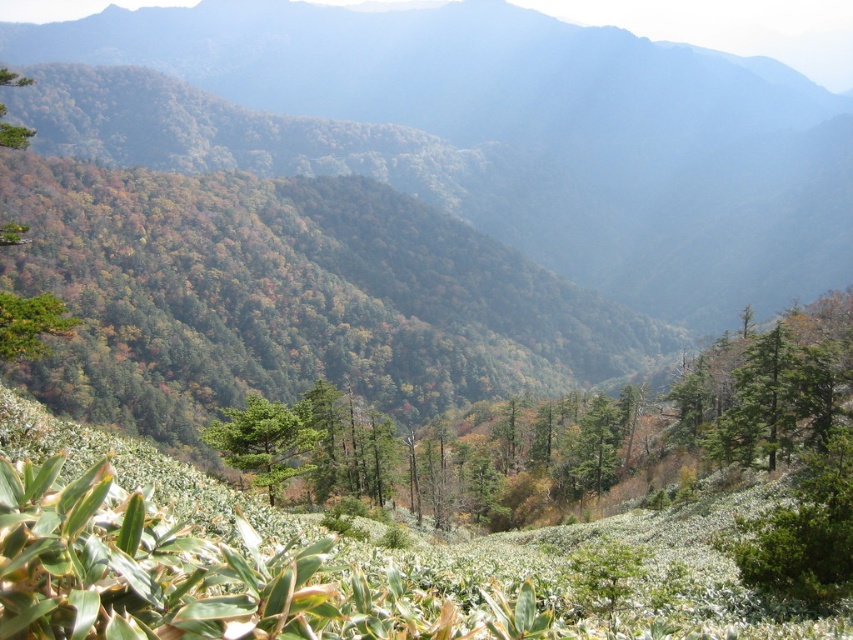
You are standing at the viewpoint and want to take a photo of the landscape. The camera you are using has a maximum focus range of 150 feet. Will the point at coordinates point [281,445] be in focus?

The distance of point [281,445] from the camera is 168.14 feet, which exceeds the camera maximum focus range of 150 feet. Therefore, the point will not be in focus.

You are standing in the autumn mountain landscape and want to take a photo. There are two points of interest marked as point 1 at coordinates (247, 440) and point 2 at coordinates (762, 403). Which point is closer to you, the photographer?

Point 1 at coordinates (247, 440) is closer to the camera than point 2 at coordinates (762, 403).